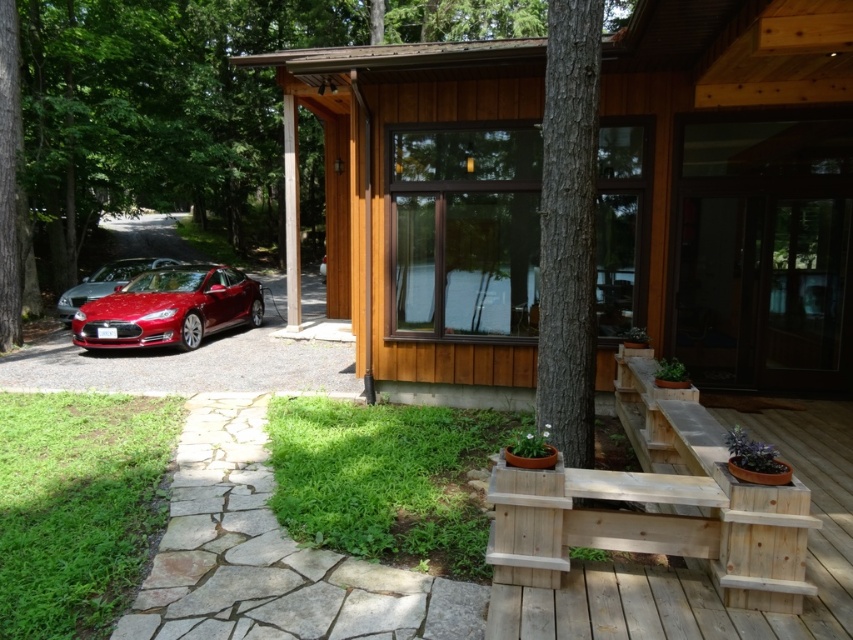
In the scene shown: Is wooden cabin at center to the right of shiny red car at left from the viewer's perspective?

Indeed, wooden cabin at center is positioned on the right side of shiny red car at left.

Which of these two, wooden cabin at center or shiny red car at left, stands taller?

Standing taller between the two is wooden cabin at center.

Who is more distant from viewer, [281,77] or [106,272]?

The point [106,272] is more distant.

Where is `wooden cabin at center`? wooden cabin at center is located at coordinates (729, 189).

From the picture: Between wooden cabin at center and light brown wooden bench at lower center, which one appears on the left side from the viewer's perspective?

wooden cabin at center

Who is shorter, wooden cabin at center or light brown wooden bench at lower center?

Standing shorter between the two is light brown wooden bench at lower center.

Which is in front, point (825, 298) or point (732, 554)?

Point (732, 554) is more forward.

This screenshot has height=640, width=853. In order to click on wooden cabin at center in this screenshot , I will do `click(729, 189)`.

Is light brown wooden bench at lower center taller than shiny metallic red sports car at left?

In fact, light brown wooden bench at lower center may be shorter than shiny metallic red sports car at left.

Which is more to the left, light brown wooden bench at lower center or shiny metallic red sports car at left?

shiny metallic red sports car at left

The width and height of the screenshot is (853, 640). I want to click on light brown wooden bench at lower center, so click(x=686, y=532).